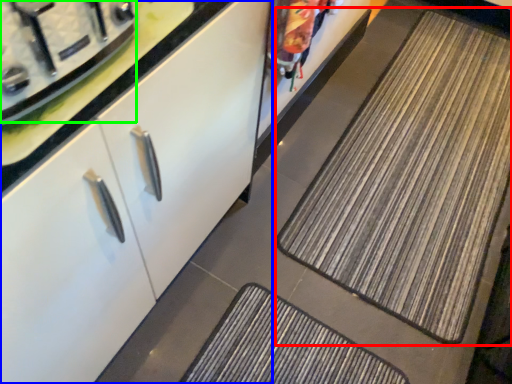
Question: Considering the real-world distances, which object is closest to mat (highlighted by a red box)? cabinetry (highlighted by a blue box) or appliance (highlighted by a green box).

Choices:
 (A) cabinetry
 (B) appliance

Answer: (A)